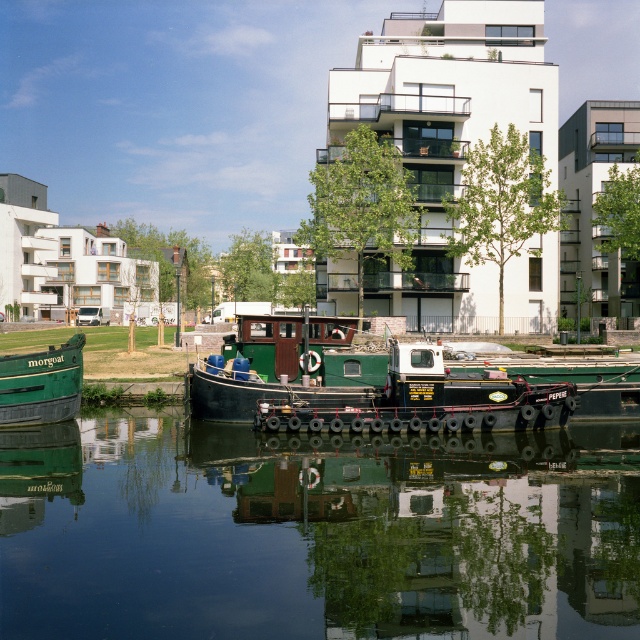
Can you confirm if black rubber water at center is thinner than green matte barge at center?

In fact, black rubber water at center might be wider than green matte barge at center.

Between point (582, 435) and point (524, 428), which one is positioned in front?

Point (524, 428) is more forward.

Does point (164, 454) come in front of point (547, 420)?

Yes, it is.

Identify the location of black rubber water at center. (316, 532).

Between point (26, 588) and point (60, 348), which one is positioned behind?

The point (60, 348) is behind.

Is black rubber water at center closer to camera compared to green matte barge at lower left?

Yes, it is in front of green matte barge at lower left.

Is point (573, 588) positioned in front of point (38, 397)?

Yes.

I want to click on black rubber water at center, so click(x=316, y=532).

Which is above, green matte barge at center or green matte barge at lower left?

green matte barge at center

From the picture: Is green matte barge at center below green matte barge at lower left?

Incorrect, green matte barge at center is not positioned below green matte barge at lower left.

Measure the distance between green matte barge at center and camera.

green matte barge at center is 24.38 meters from camera.

This screenshot has height=640, width=640. I want to click on green matte barge at center, so click(x=356, y=384).